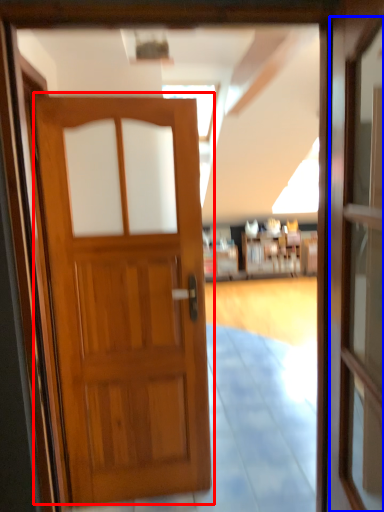
Question: Among these objects, which one is farthest to the camera, door (highlighted by a red box) or screen door (highlighted by a blue box)?

Choices:
 (A) door
 (B) screen door

Answer: (A)